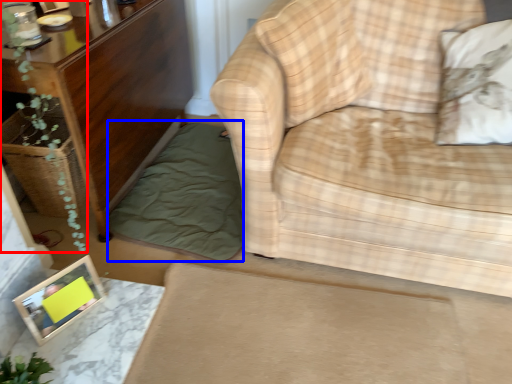
Question: Which object is closer to the camera taking this photo, plant (highlighted by a red box) or bedding (highlighted by a blue box)?

Choices:
 (A) plant
 (B) bedding

Answer: (A)